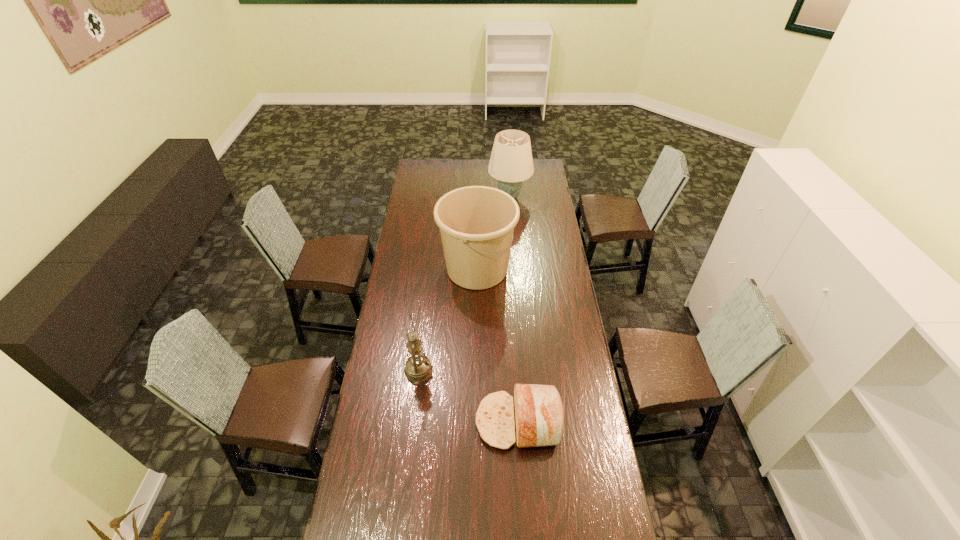
You are a GUI agent. You are given a task and a screenshot of the screen. Output one action in this format:
    pyautogui.click(x=<x>, y=<y>)
    Task: Click on the free location located 0.070m at the sliced end of the nearest object
    
    Given the screenshot: What is the action you would take?
    pyautogui.click(x=457, y=421)

Image resolution: width=960 pixels, height=540 pixels. In order to click on object that is at the left edge in this screenshot , I will do `click(418, 367)`.

At what (x,y) coordinates should I click in order to perform the action: click on lampshade located at the right edge. Please return your answer as a coordinate pair (x, y). This screenshot has height=540, width=960. Looking at the image, I should click on (511, 162).

Image resolution: width=960 pixels, height=540 pixels. What are the coordinates of `bread present at the right edge` in the screenshot? It's located at (539, 413).

I want to click on vacant space at the left edge of the desktop, so click(x=392, y=437).

Locate an element on the screen. This screenshot has width=960, height=540. vacant space at the right edge is located at coordinates (568, 275).

At what (x,y) coordinates should I click in order to perform the action: click on free space that is in between the bucket and the third farthest object. Please return your answer as a coordinate pair (x, y). Looking at the image, I should click on (447, 320).

Where is `vacant point located between the second farthest object and the nearest object`? vacant point located between the second farthest object and the nearest object is located at coordinates (497, 345).

Where is `blank region between the second farthest object and the second nearest object`? blank region between the second farthest object and the second nearest object is located at coordinates (447, 320).

Identify the location of the second closest object to the farthest object. (418, 367).